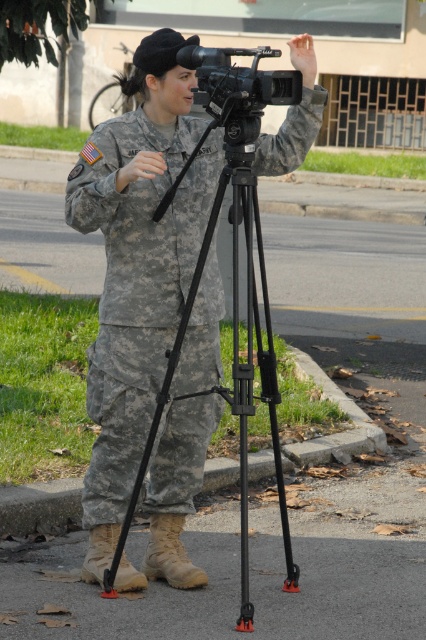
Between point (97, 401) and point (249, 241), which one is positioned in front?

Point (249, 241) is in front.

In the scene shown: Can you confirm if camouflage fabric uniform at center is shorter than black matte tripod at center?

Yes, camouflage fabric uniform at center is shorter than black matte tripod at center.

Where is `camouflage fabric uniform at center`? Image resolution: width=426 pixels, height=640 pixels. camouflage fabric uniform at center is located at coordinates (135, 285).

At what (x,y) coordinates should I click in order to perform the action: click on camouflage fabric uniform at center. Please return your answer as a coordinate pair (x, y). The image size is (426, 640). Looking at the image, I should click on (135, 285).

Does black matte tripod at center appear on the left side of black matte camera at center?

Correct, you'll find black matte tripod at center to the left of black matte camera at center.

Is point (239, 612) in front of point (207, 112)?

Yes, it is in front of point (207, 112).

Where is `black matte tripod at center`? The width and height of the screenshot is (426, 640). black matte tripod at center is located at coordinates (233, 355).

Locate an element on the screen. black matte tripod at center is located at coordinates [x=233, y=355].

Which of these two, camouflage fabric uniform at center or black matte camera at center, stands shorter?

black matte camera at center is shorter.

Does point (193, 419) come in front of point (259, 90)?

No, (193, 419) is further to viewer.

Where is `camouflage fabric uniform at center`? This screenshot has width=426, height=640. camouflage fabric uniform at center is located at coordinates (135, 285).